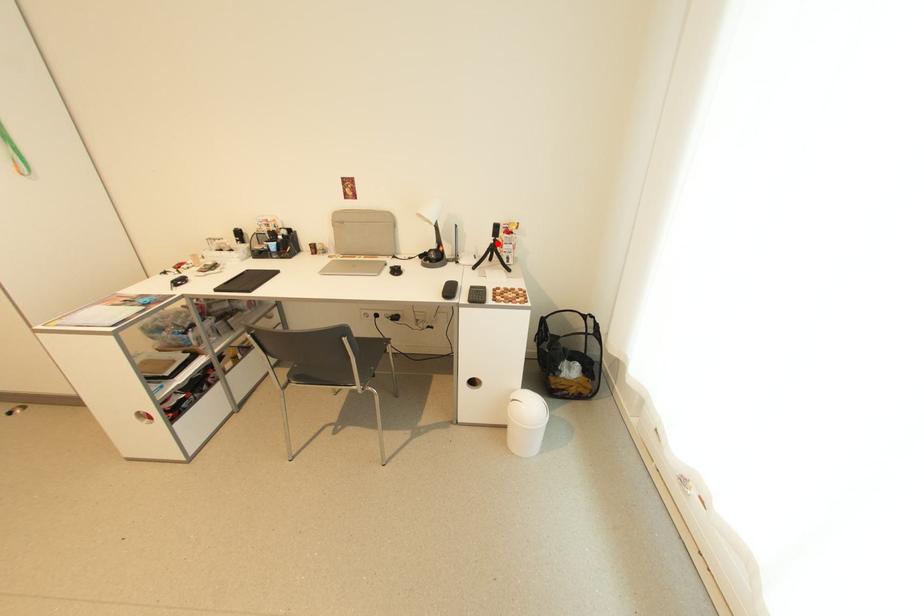
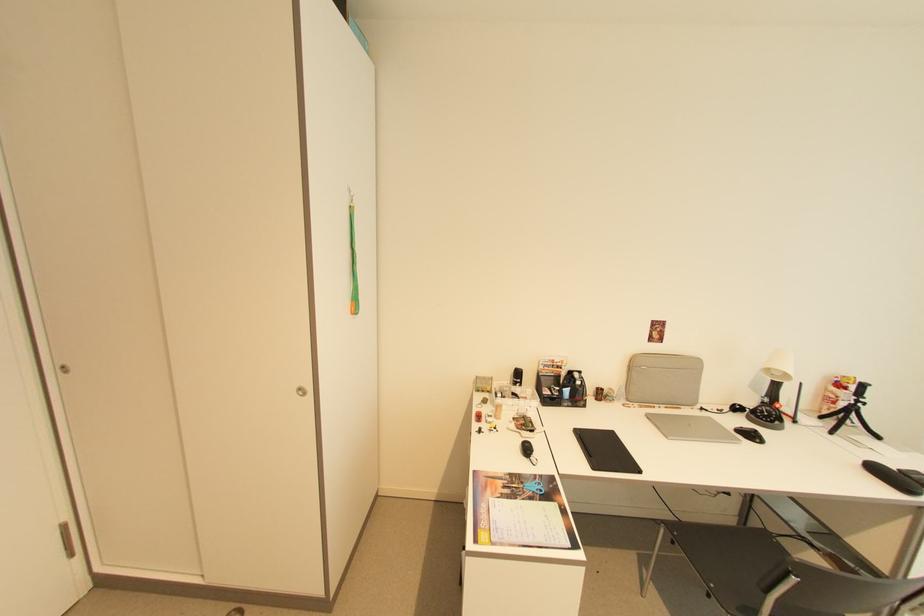
Find the pixel in the second image that matches the highlighted location in the first image.

(857, 405)